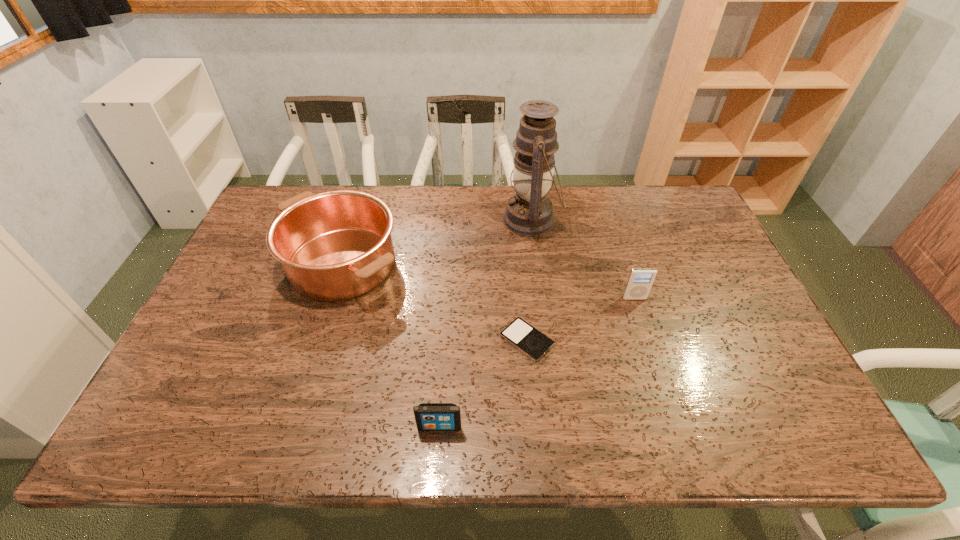
This screenshot has height=540, width=960. I want to click on free location located on the right of the fourth shortest object, so [522, 264].

Locate an element on the screen. blank space located on the front-facing side of the tallest iPod is located at coordinates (675, 424).

This screenshot has width=960, height=540. I want to click on free location located 0.140m on the right of the fourth farthest object, so click(608, 340).

Image resolution: width=960 pixels, height=540 pixels. I want to click on oil lamp that is at the far edge, so (529, 212).

The width and height of the screenshot is (960, 540). I want to click on saucepan situated at the far edge, so click(x=336, y=245).

At what (x,y) coordinates should I click in order to perform the action: click on object that is at the near edge. Please return your answer as a coordinate pair (x, y). The height and width of the screenshot is (540, 960). Looking at the image, I should click on (429, 416).

What are the coordinates of `object at the left edge` in the screenshot? It's located at (336, 245).

At what (x,y) coordinates should I click in order to perform the action: click on object that is at the far left corner. Please return your answer as a coordinate pair (x, y). Looking at the image, I should click on (336, 245).

You are a GUI agent. You are given a task and a screenshot of the screen. Output one action in this format:
    pyautogui.click(x=<x>, y=<y>)
    Task: Click on the vacant space at the far edge
    The width and height of the screenshot is (960, 540).
    Given the screenshot: What is the action you would take?
    pyautogui.click(x=445, y=214)

Identify the location of vacant space at the near edge of the desktop. The height and width of the screenshot is (540, 960). (403, 441).